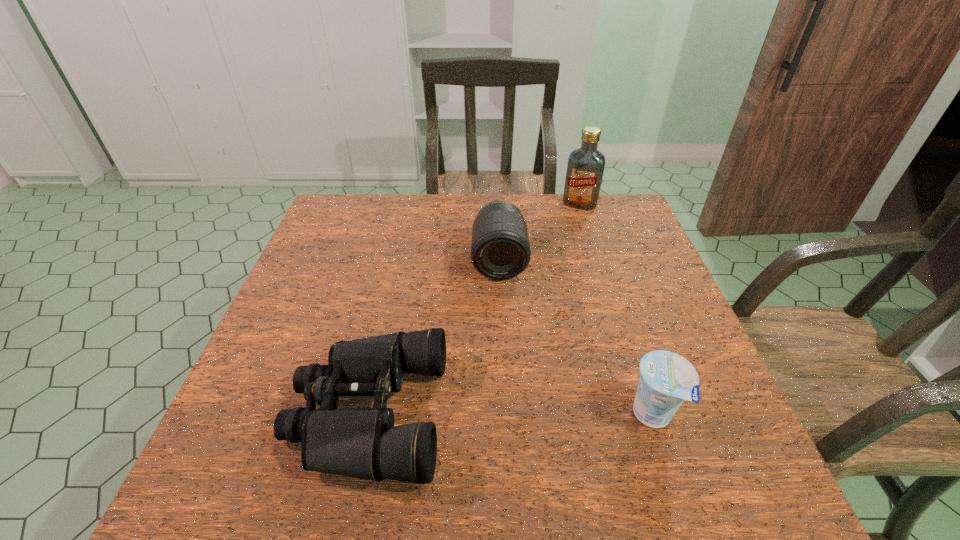
Where is `vacant area situated 0.170m on the surface of the third object from right to left`? Image resolution: width=960 pixels, height=540 pixels. vacant area situated 0.170m on the surface of the third object from right to left is located at coordinates (502, 332).

Locate an element on the screen. free space located on the surface of the third object from right to left is located at coordinates (501, 316).

I want to click on free spot located on the front-facing side of the vodka, so (563, 238).

I want to click on vacant space located 0.340m on the front-facing side of the vodka, so click(x=545, y=275).

I want to click on vacant region located 0.180m on the front-facing side of the vodka, so click(561, 242).

Locate an element on the screen. object that is positioned at the far edge is located at coordinates (585, 168).

The height and width of the screenshot is (540, 960). Identify the location of binoculars that is at the near edge. (363, 443).

This screenshot has width=960, height=540. I want to click on yogurt situated at the near edge, so click(x=667, y=379).

Identify the location of object located in the left edge section of the desktop. (363, 443).

At what (x,y) coordinates should I click in order to perform the action: click on yogurt that is at the right edge. Please return your answer as a coordinate pair (x, y). The height and width of the screenshot is (540, 960). Looking at the image, I should click on (667, 379).